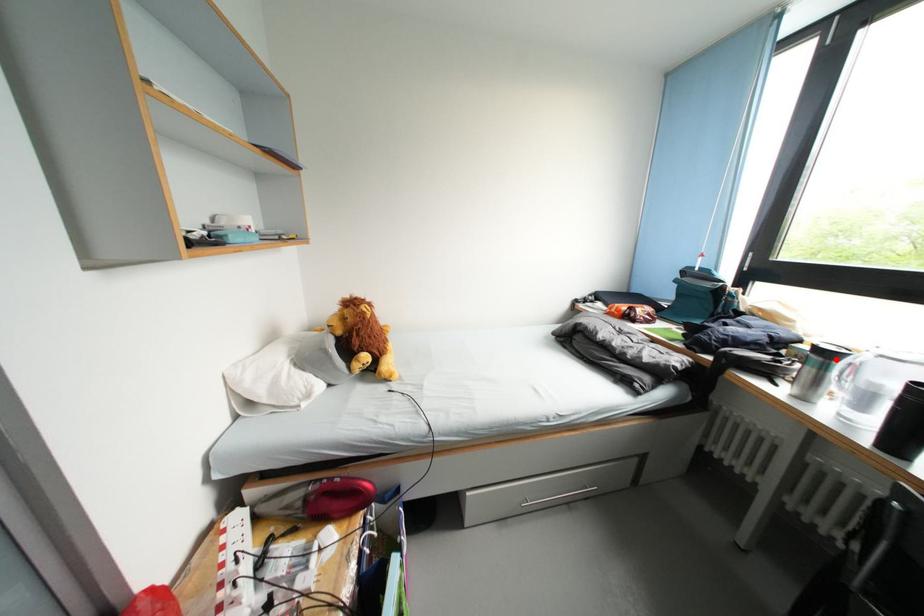
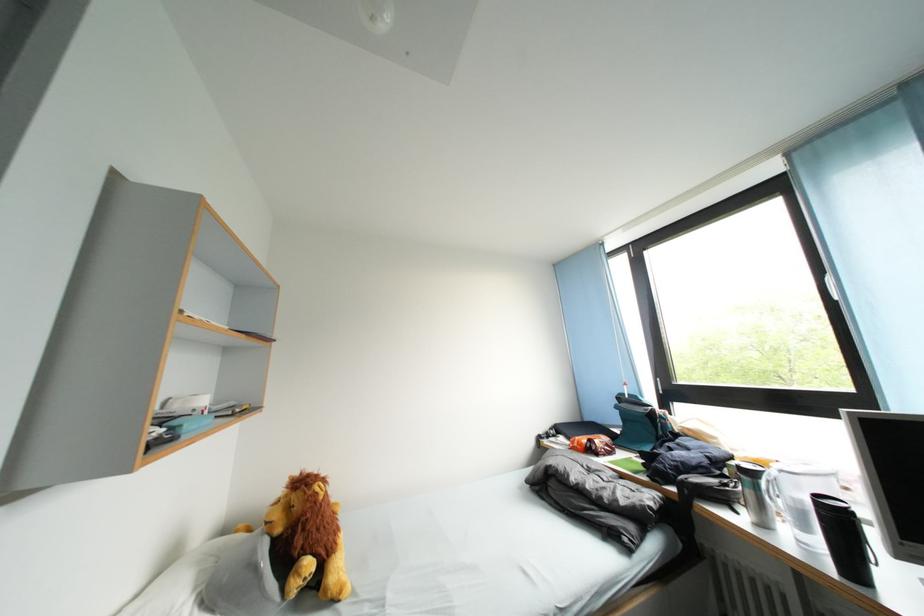
In the second image, find the point that corresponds to the highlighted location in the first image.

(759, 479)